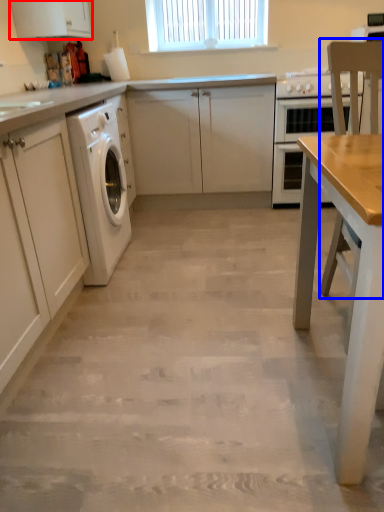
Question: Which object is closer to the camera taking this photo, cabinetry (highlighted by a red box) or chair (highlighted by a blue box)?

Choices:
 (A) cabinetry
 (B) chair

Answer: (B)